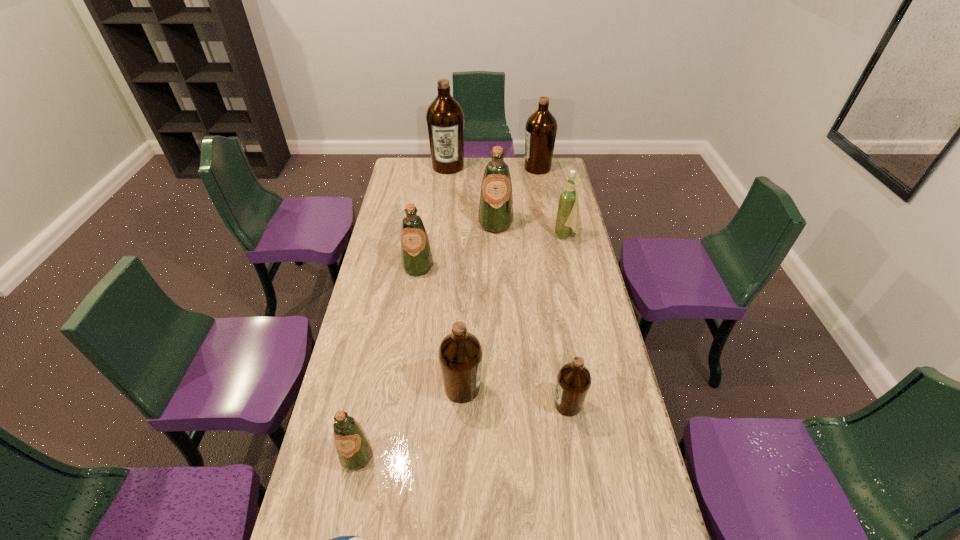
Locate an element on the screen. Image resolution: width=960 pixels, height=540 pixels. vacant space located 0.330m on the front-facing side of the fifth farthest object is located at coordinates (407, 345).

Locate an element on the screen. This screenshot has height=540, width=960. free space located 0.060m on the label of the second smallest brown olive oil is located at coordinates (501, 388).

You are a GUI agent. You are given a task and a screenshot of the screen. Output one action in this format:
    pyautogui.click(x=<x>, y=<y>)
    Task: Click on the vacant area situated 0.210m on the label of the smallest brown olive oil
    This screenshot has height=540, width=960.
    Given the screenshot: What is the action you would take?
    pyautogui.click(x=484, y=404)

Identify the location of vacant space located on the label of the smallest brown olive oil. (464, 404).

In order to click on free space located 0.280m on the label of the smallest brown olive oil in this screenshot , I will do `click(461, 404)`.

Image resolution: width=960 pixels, height=540 pixels. What are the coordinates of `vacant space positioned on the front-facing side of the smallest green olive oil` in the screenshot? It's located at (341, 535).

The height and width of the screenshot is (540, 960). In order to click on wine bottle at the right edge in this screenshot , I will do `click(567, 220)`.

This screenshot has height=540, width=960. Find the location of `object located in the far right corner section of the desktop`. object located in the far right corner section of the desktop is located at coordinates (541, 127).

This screenshot has width=960, height=540. In order to click on vacant space at the far edge of the desktop in this screenshot , I will do `click(479, 179)`.

Locate an element on the screen. vacant space at the left edge is located at coordinates (369, 318).